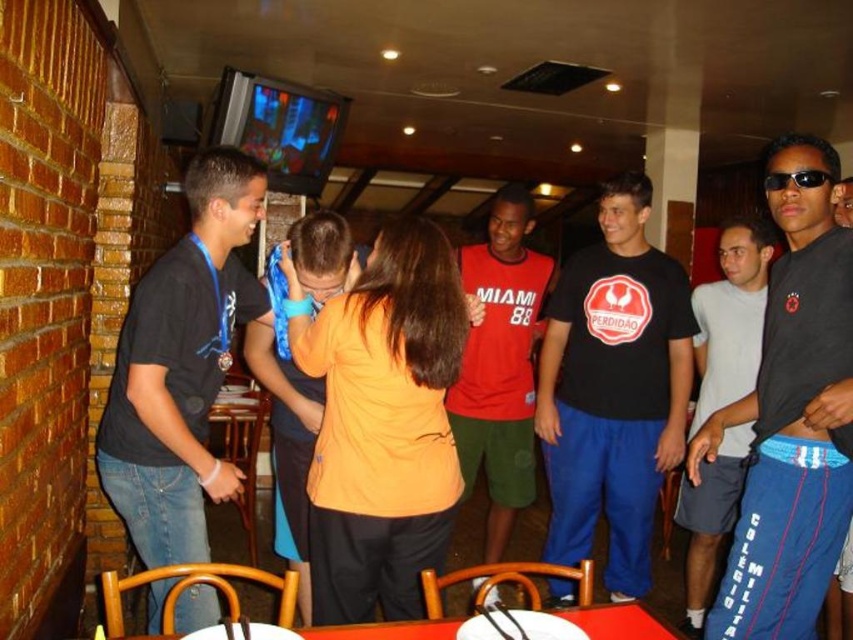
In the image, there is a point at coordinates (613, 388). Which object in the scene does this point correspond to?

The point at coordinates (613, 388) corresponds to the black matte t shirt at center.